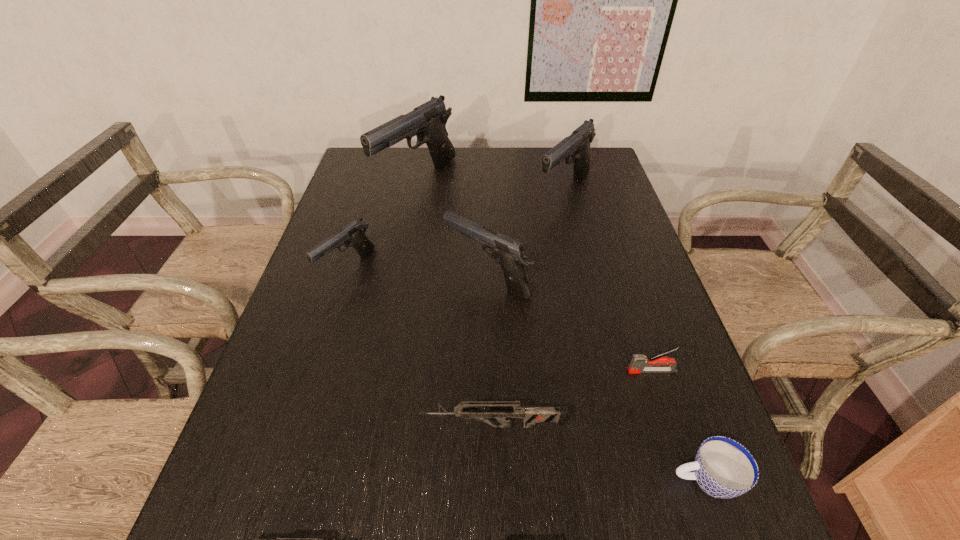
Find the location of a particular element. This screenshot has height=540, width=960. stapler positioned at the right edge is located at coordinates (637, 365).

Locate an element on the screen. This screenshot has width=960, height=540. cup that is at the right edge is located at coordinates pos(723,468).

Locate an element on the screen. The image size is (960, 540). object positioned at the far left corner is located at coordinates (428, 121).

The height and width of the screenshot is (540, 960). What are the coordinates of `object that is at the far right corner` in the screenshot? It's located at (577, 145).

Find the location of a particular element. free space at the far edge of the desktop is located at coordinates (517, 180).

Identify the location of vacant space at the near edge of the desktop. Image resolution: width=960 pixels, height=540 pixels. (468, 535).

In the image, there is a desktop. Where is `vacant space at the left edge`? vacant space at the left edge is located at coordinates (349, 202).

In the image, there is a desktop. Where is `vacant space at the right edge`? vacant space at the right edge is located at coordinates (580, 204).

In the image, there is a desktop. Identify the location of free space at the far left corner. (382, 164).

Image resolution: width=960 pixels, height=540 pixels. I want to click on vacant space in between the right grey gun and the biggest black gun, so click(455, 303).